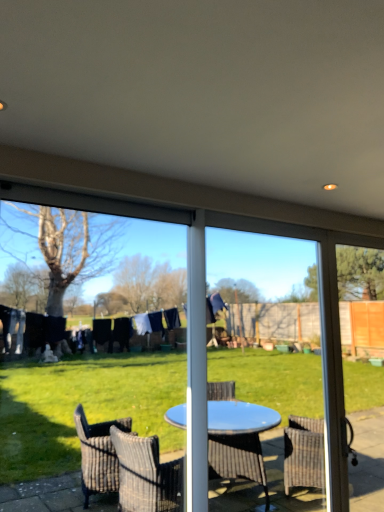
Question: Does transparent glass screen door at right, which appears as the 1th screen door when viewed from the right, turn towards blue plastic table at center, the 2th screen door in the right-to-left sequence?

Choices:
 (A) no
 (B) yes

Answer: (A)

Question: Considering the relative sizes of transparent glass screen door at right, the second screen door when ordered from left to right, and blue plastic table at center, positioned as the 1th screen door in left-to-right order, in the image provided, is transparent glass screen door at right, the second screen door when ordered from left to right, bigger than blue plastic table at center, positioned as the 1th screen door in left-to-right order,?

Choices:
 (A) no
 (B) yes

Answer: (A)

Question: Is transparent glass screen door at right, the second screen door when ordered from left to right, closer to the viewer compared to blue plastic table at center, positioned as the 1th screen door in left-to-right order?

Choices:
 (A) no
 (B) yes

Answer: (A)

Question: From the image's perspective, is transparent glass screen door at right, the second screen door when ordered from left to right, on top of blue plastic table at center, the 2th screen door in the right-to-left sequence?

Choices:
 (A) yes
 (B) no

Answer: (B)

Question: Is transparent glass screen door at right, which appears as the 1th screen door when viewed from the right, thinner than blue plastic table at center, the 2th screen door in the right-to-left sequence?

Choices:
 (A) no
 (B) yes

Answer: (A)

Question: Does point (117, 221) appear closer or farther from the camera than point (380, 353)?

Choices:
 (A) farther
 (B) closer

Answer: (A)

Question: From their relative heights in the image, would you say transparent plastic screen at center is taller or shorter than transparent glass screen door at right, the second screen door when ordered from left to right?

Choices:
 (A) tall
 (B) short

Answer: (B)

Question: From a real-world perspective, is transparent plastic screen at center above or below transparent glass screen door at right, which appears as the 1th screen door when viewed from the right?

Choices:
 (A) below
 (B) above

Answer: (B)

Question: Considering the relative positions of transparent plastic screen at center and transparent glass screen door at right, the second screen door when ordered from left to right, in the image provided, is transparent plastic screen at center to the left or to the right of transparent glass screen door at right, the second screen door when ordered from left to right,?

Choices:
 (A) right
 (B) left

Answer: (B)

Question: Considering their positions, is blue plastic table at center, the 2th screen door in the right-to-left sequence, located in front of or behind transparent plastic screen at center?

Choices:
 (A) front
 (B) behind

Answer: (B)

Question: From the image's perspective, relative to transparent plastic screen at center, is blue plastic table at center, positioned as the 1th screen door in left-to-right order, above or below?

Choices:
 (A) below
 (B) above

Answer: (A)

Question: Is blue plastic table at center, the 2th screen door in the right-to-left sequence, situated inside transparent plastic screen at center or outside?

Choices:
 (A) outside
 (B) inside

Answer: (A)

Question: Considering the positions of blue plastic table at center, positioned as the 1th screen door in left-to-right order, and transparent plastic screen at center in the image, is blue plastic table at center, positioned as the 1th screen door in left-to-right order, taller or shorter than transparent plastic screen at center?

Choices:
 (A) tall
 (B) short

Answer: (A)

Question: Considering the positions of transparent glass screen door at right, which appears as the 1th screen door when viewed from the right, and blue plastic table at center, positioned as the 1th screen door in left-to-right order, in the image, is transparent glass screen door at right, which appears as the 1th screen door when viewed from the right, bigger or smaller than blue plastic table at center, positioned as the 1th screen door in left-to-right order,?

Choices:
 (A) big
 (B) small

Answer: (B)

Question: Would you say transparent glass screen door at right, the second screen door when ordered from left to right, is to the left or to the right of blue plastic table at center, positioned as the 1th screen door in left-to-right order, in the picture?

Choices:
 (A) left
 (B) right

Answer: (B)